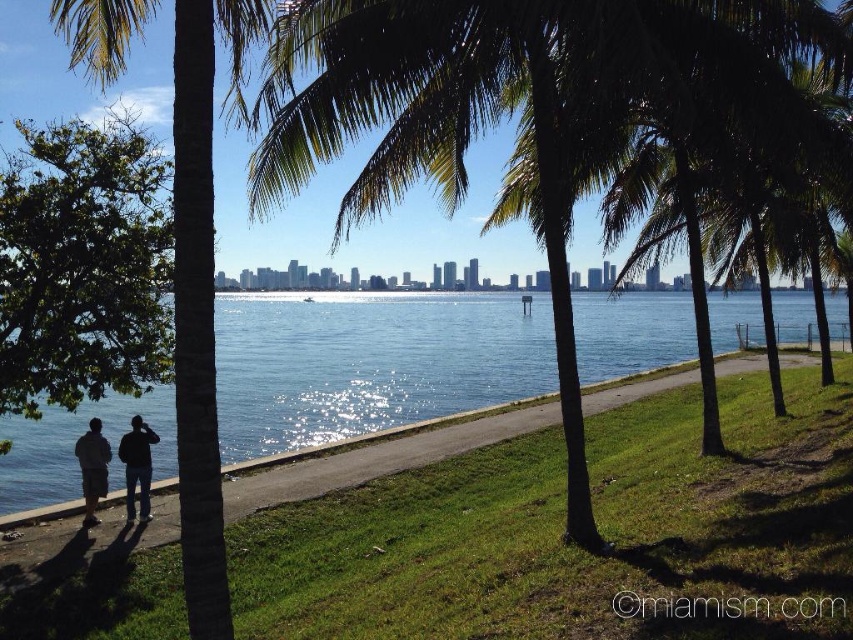
Question: Which object is closer to the camera taking this photo?

Choices:
 (A) green leafy palm tree at center
 (B) blue water at center
 (C) green leafy tree at left
 (D) black fabric person at lower left

Answer: (A)

Question: Does black fabric person at lower left have a smaller size compared to dark gray hoodie at lower left?

Choices:
 (A) yes
 (B) no

Answer: (B)

Question: Among these objects, which one is nearest to the camera?

Choices:
 (A) green leafy palm tree at left
 (B) green leafy palm tree at center
 (C) black fabric person at lower left

Answer: (B)

Question: Is the position of black fabric person at lower left less distant than that of dark gray hoodie at lower left?

Choices:
 (A) yes
 (B) no

Answer: (B)

Question: Can you confirm if green leafy palm tree at left is thinner than black fabric person at lower left?

Choices:
 (A) yes
 (B) no

Answer: (B)

Question: Which of the following is the closest to the observer?

Choices:
 (A) green leafy palm tree at center
 (B) blue water at center

Answer: (A)